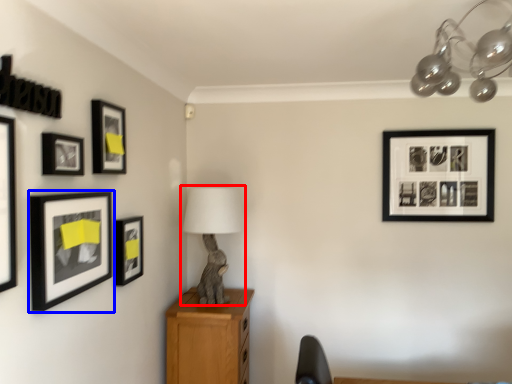
Question: Among these objects, which one is farthest to the camera, table lamp (highlighted by a red box) or picture frame (highlighted by a blue box)?

Choices:
 (A) table lamp
 (B) picture frame

Answer: (A)